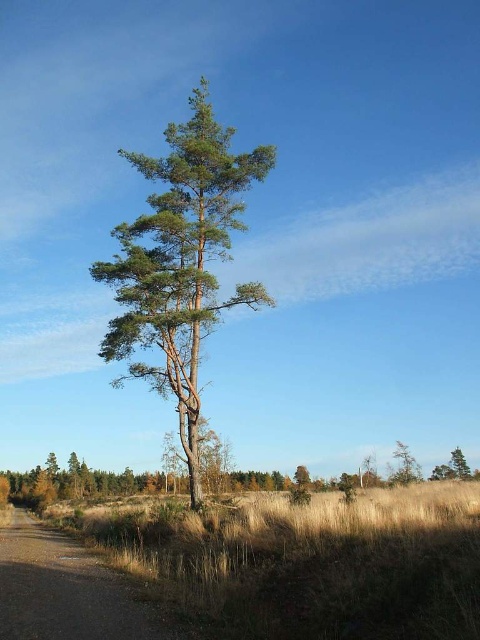
Question: Which object is closer to the camera taking this photo?

Choices:
 (A) green textured pine tree at center
 (B) dirt/gravel path at lower left
 (C) green matte tree at lower right
 (D) brown grass at lower center

Answer: (D)

Question: From the image, what is the correct spatial relationship of dirt/gravel path at lower left in relation to green matte tree at lower right?

Choices:
 (A) above
 (B) below

Answer: (A)

Question: Which is farther from the dirt/gravel path at lower left?

Choices:
 (A) brown grass at lower center
 (B) green matte tree at lower right
 (C) green textured pine tree at center

Answer: (B)

Question: Which point is farther to the camera?

Choices:
 (A) green matte tree at lower right
 (B) brown grass at lower center
 (C) green textured pine tree at center
 (D) dirt/gravel path at lower left

Answer: (A)

Question: Can you confirm if green textured pine tree at center is smaller than dirt/gravel path at lower left?

Choices:
 (A) no
 (B) yes

Answer: (B)

Question: Does brown grass at lower center have a lesser width compared to dirt/gravel path at lower left?

Choices:
 (A) yes
 (B) no

Answer: (B)